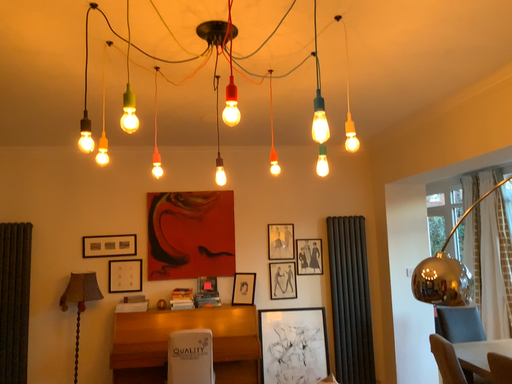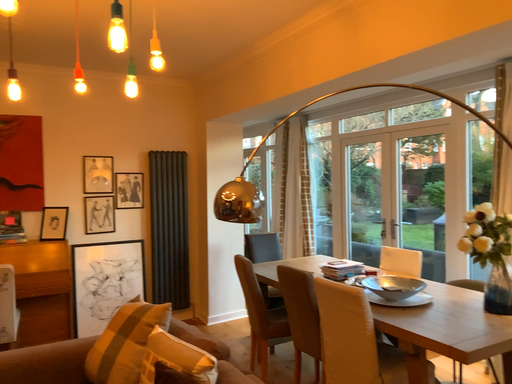
Question: Which way did the camera rotate in the video?

Choices:
 (A) rotated upward
 (B) rotated downward

Answer: (B)